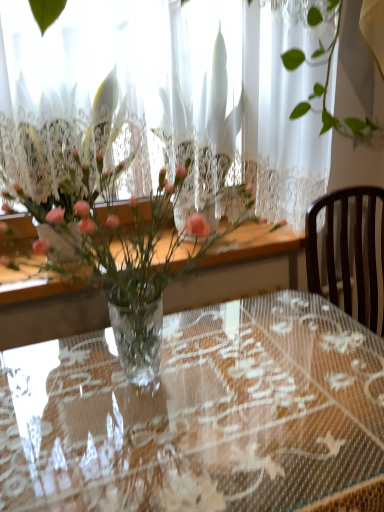
Question: Does point (147, 321) appear closer or farther from the camera than point (84, 387)?

Choices:
 (A) farther
 (B) closer

Answer: (B)

Question: Considering the relative positions of translucent glass vase at center and transparent lace tablecloth at center in the image provided, is translucent glass vase at center to the left or to the right of transparent lace tablecloth at center?

Choices:
 (A) right
 (B) left

Answer: (B)

Question: From a real-world perspective, is translucent glass vase at center physically located above or below transparent lace tablecloth at center?

Choices:
 (A) below
 (B) above

Answer: (B)

Question: From a real-world perspective, is transparent lace tablecloth at center positioned above or below translucent glass vase at center?

Choices:
 (A) below
 (B) above

Answer: (A)

Question: Would you say transparent lace tablecloth at center is inside or outside translucent glass vase at center?

Choices:
 (A) outside
 (B) inside

Answer: (A)

Question: Relative to translucent glass vase at center, is transparent lace tablecloth at center in front or behind?

Choices:
 (A) behind
 (B) front

Answer: (B)

Question: In terms of width, does transparent lace tablecloth at center look wider or thinner when compared to translucent glass vase at center?

Choices:
 (A) thin
 (B) wide

Answer: (B)